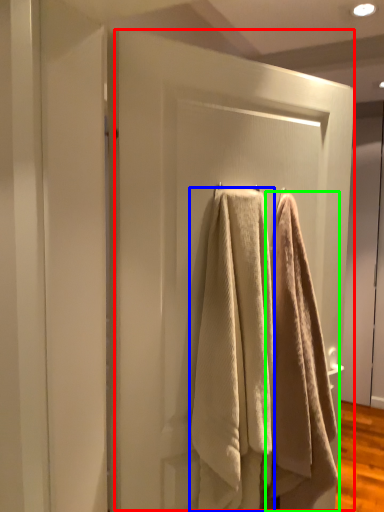
Question: Which object is the closest to the screen door (highlighted by a red box)? Choose among these: towel (highlighted by a blue box) or towel (highlighted by a green box).

Choices:
 (A) towel
 (B) towel

Answer: (A)